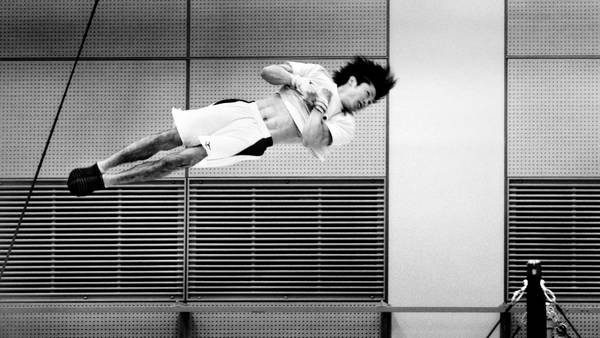
Image resolution: width=600 pixels, height=338 pixels. In order to click on cables in this screenshot , I will do `click(501, 318)`, `click(568, 321)`.